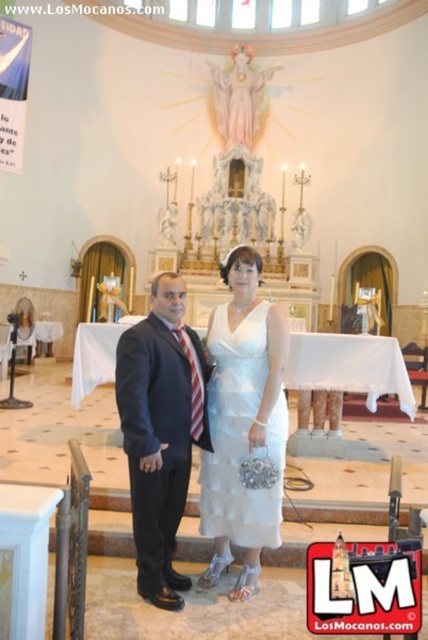
Does matte black suit at center have a smaller size compared to white satin dress at center?

No.

Which is in front, point (196, 365) or point (279, 520)?

Point (279, 520) is in front.

Image resolution: width=428 pixels, height=640 pixels. Identify the location of matte black suit at center. (160, 432).